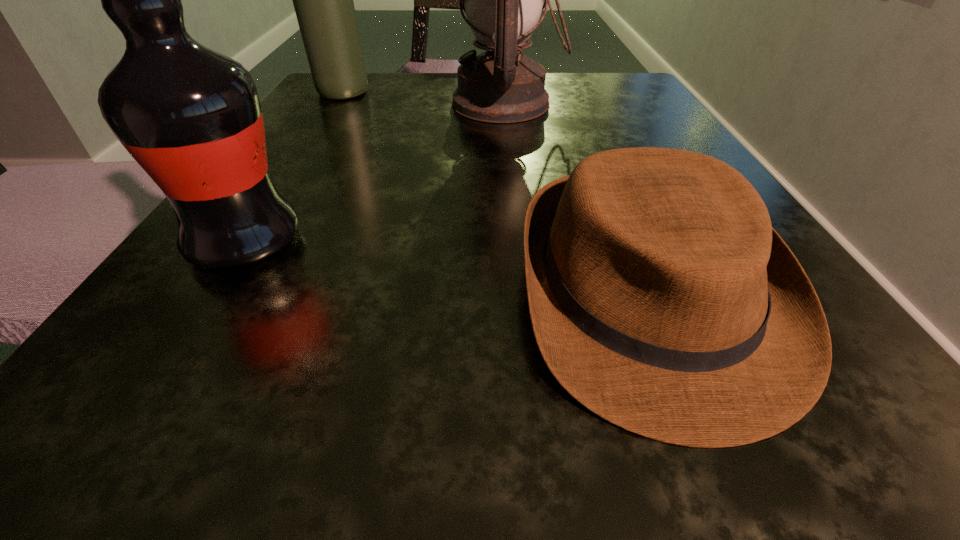
The height and width of the screenshot is (540, 960). Identify the location of object that is positioned at the right edge. (661, 298).

Locate an element on the screen. object at the far left corner is located at coordinates (323, 0).

This screenshot has height=540, width=960. Find the location of `object that is at the near right corner`. object that is at the near right corner is located at coordinates (661, 298).

At what (x,y) coordinates should I click in order to perform the action: click on vacant area at the far edge of the desktop. Please return your answer as a coordinate pair (x, y). Looking at the image, I should click on (437, 80).

Locate an element on the screen. Image resolution: width=960 pixels, height=540 pixels. free location at the near edge of the desktop is located at coordinates (344, 357).

Find the location of a particular element. The width and height of the screenshot is (960, 540). free location at the left edge is located at coordinates (307, 120).

This screenshot has width=960, height=540. I want to click on vacant area at the far right corner of the desktop, so click(640, 85).

This screenshot has height=540, width=960. I want to click on vacant space at the near right corner, so click(x=828, y=391).

Image resolution: width=960 pixels, height=540 pixels. I want to click on unoccupied position between the farther wine bottle and the shortest object, so click(x=495, y=195).

Identify the location of blank region between the nearer wine bottle and the oil lamp. (376, 173).